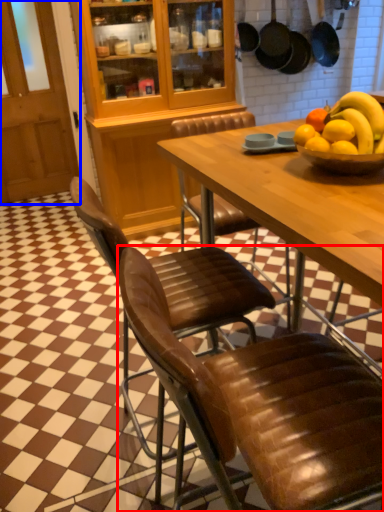
Question: Which object is closer to the camera taking this photo, chair (highlighted by a red box) or glass door (highlighted by a blue box)?

Choices:
 (A) chair
 (B) glass door

Answer: (A)